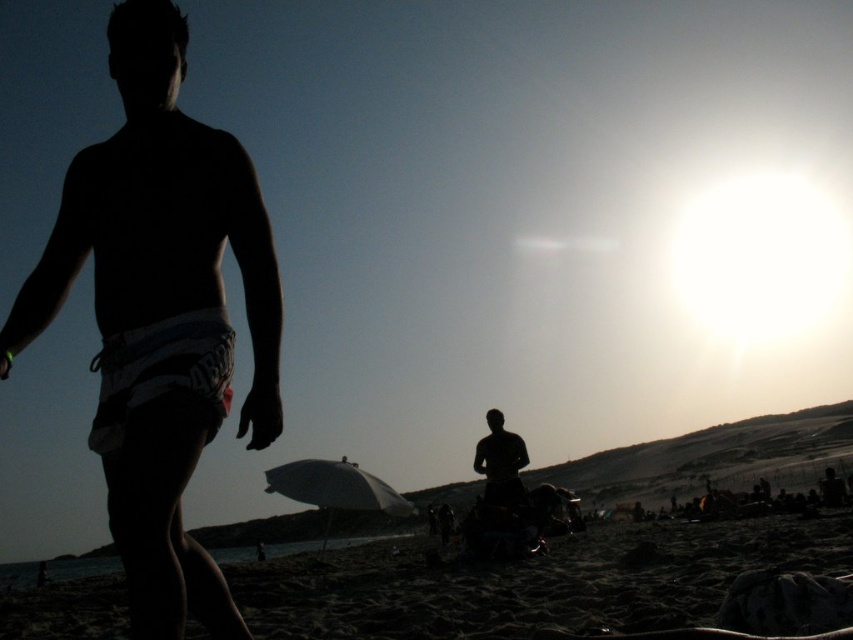
Is point (111, 336) farther from viewer compared to point (778, 552)?

No, (111, 336) is closer to viewer.

Does silhouette shorts at left have a smaller size compared to dark sand at lower center?

Indeed, silhouette shorts at left has a smaller size compared to dark sand at lower center.

Who is more distant from viewer, (206, 570) or (282, 621)?

Positioned behind is point (282, 621).

Identify the location of silhouette shorts at left. This screenshot has height=640, width=853. (161, 314).

The image size is (853, 640). I want to click on dark sand at lower center, so click(x=531, y=580).

Can you confirm if silhouette shorts at left is positioned to the right of silhouette figure at center?

Incorrect, silhouette shorts at left is not on the right side of silhouette figure at center.

In the scene shown: Who is more distant from viewer, (206,570) or (486,416)?

Positioned behind is point (486,416).

Locate an element on the screen. silhouette shorts at left is located at coordinates (161, 314).